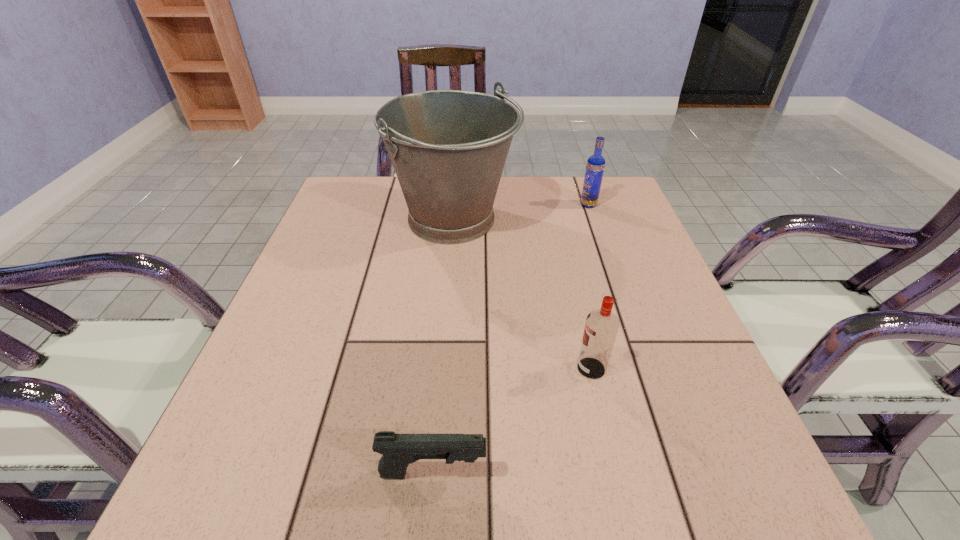
This screenshot has width=960, height=540. Find the location of `the tallest object`. the tallest object is located at coordinates (448, 148).

Locate an element on the screen. The height and width of the screenshot is (540, 960). the right vodka is located at coordinates (595, 166).

Find the location of a particular element. The height and width of the screenshot is (540, 960). the rightmost object is located at coordinates (595, 166).

I want to click on the left vodka, so click(601, 327).

The image size is (960, 540). I want to click on the third object from left to right, so click(601, 327).

I want to click on the nearest object, so click(398, 451).

Where is `pistol`? pistol is located at coordinates tap(398, 451).

The image size is (960, 540). What are the coordinates of `free space located 0.170m on the right of the bucket` in the screenshot? It's located at (583, 219).

The height and width of the screenshot is (540, 960). I want to click on free region located 0.050m on the left of the rightmost object, so click(x=562, y=205).

Find the location of `vacant region located 0.140m on the front label of the nearer vodka`. vacant region located 0.140m on the front label of the nearer vodka is located at coordinates (497, 368).